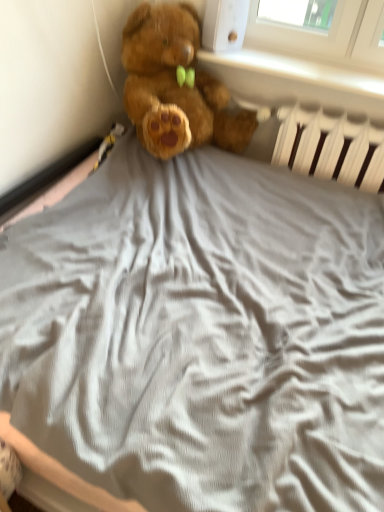
What is the approximate height of white plastic window sill at upper center?

white plastic window sill at upper center is 2.27 inches in height.

This screenshot has width=384, height=512. Describe the element at coordinates (297, 71) in the screenshot. I see `white plastic window sill at upper center` at that location.

Locate an element on the screen. white plastic window sill at upper center is located at coordinates (297, 71).

This screenshot has width=384, height=512. I want to click on white plastic window sill at upper center, so click(297, 71).